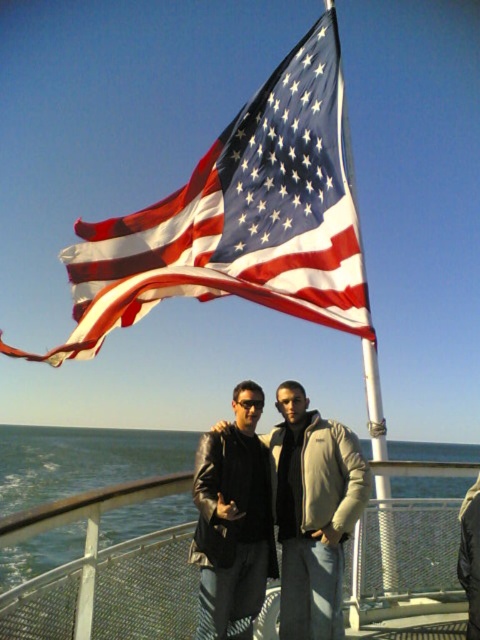
Consider the image. You are a photographer trying to capture a group photo of the leather jacket at center and the khaki cotton jacket at center. The minimum distance required for your camera to focus properly is 8 meters. Based on the scene, can you take a clear photo of both jackets at the same time?

The leather jacket at center and khaki cotton jacket at center are 7.87 meters apart. Since the required minimum distance for the camera to focus is 8 meters, the jackets are slightly too close to each other. You might need to adjust their positions to increase the distance to at least 8 meters for a clear photo.

Consider the image. You are a photographer standing at the front of the boat deck. You want to take a photo where the American flag at upper center is clearly visible above the matte black leather jacket at center. Based on their relative heights, is this possible?

The American flag at upper center has a greater height compared to the matte black leather jacket at center, so yes, it is possible to position the camera so the flag appears clearly above the jacket in the photo.